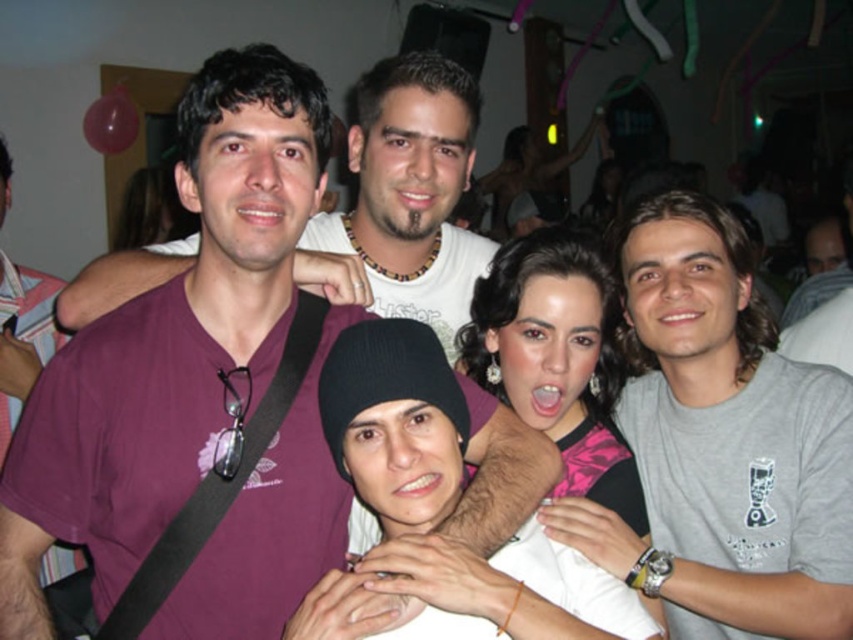
Does purple matte t-shirt at center have a smaller size compared to gray cotton t-shirt at right?

Yes.

Between purple matte t-shirt at center and gray cotton t-shirt at right, which one has less height?

purple matte t-shirt at center

Is point (149, 480) less distant than point (722, 230)?

Yes, it is.

Find the location of `purple matte t-shirt at center`. purple matte t-shirt at center is located at coordinates (167, 339).